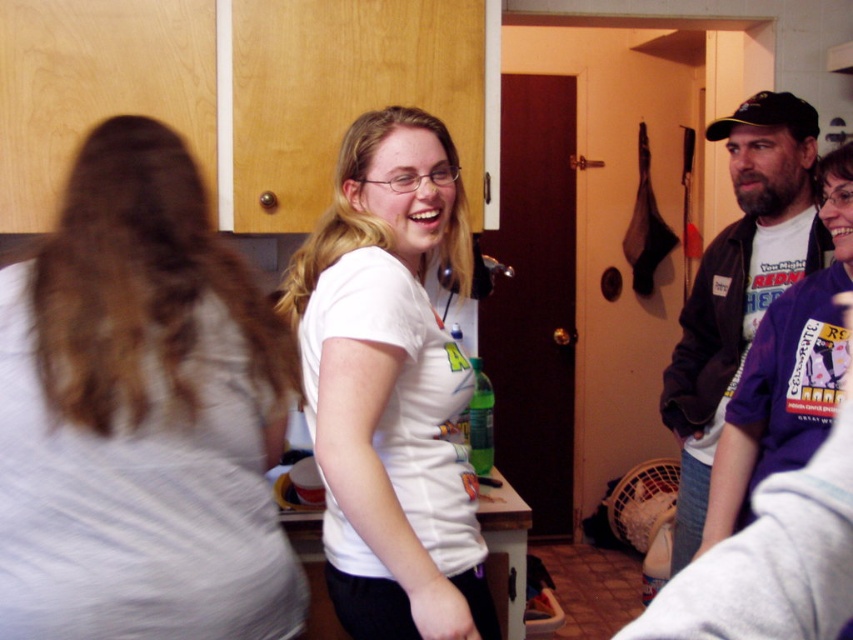
Where is the light gray cotton shirt at center located in the image?

The light gray cotton shirt at center is located at point 0.650 on the x axis and 0.165 on the y axis.